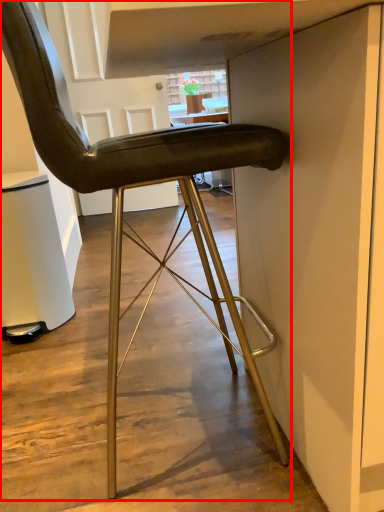
Question: Observing the image, what is the correct spatial positioning of chair (annotated by the red box) in reference to cabinetry?

Choices:
 (A) left
 (B) right

Answer: (B)